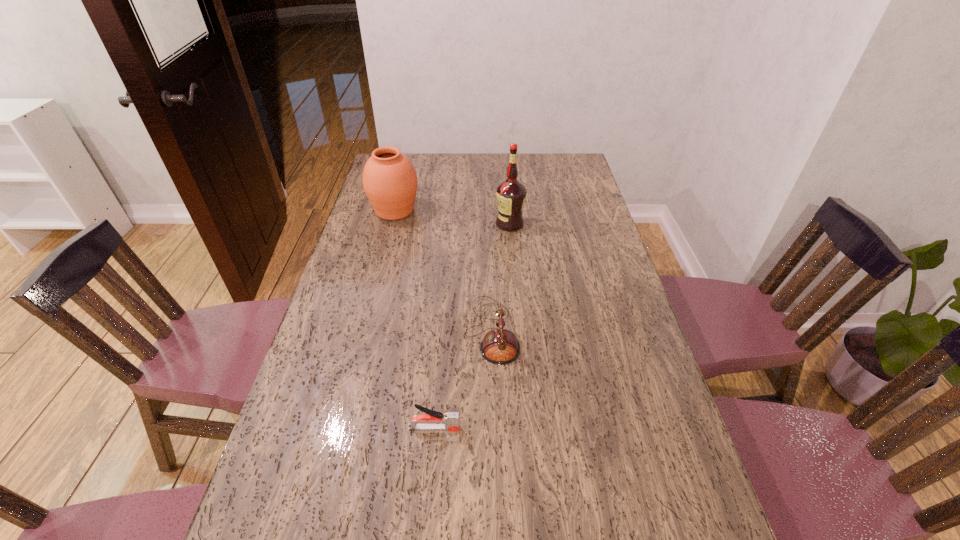
Find the location of a particular element. The width and height of the screenshot is (960, 540). alcohol is located at coordinates (511, 194).

Where is `the second tallest object`? the second tallest object is located at coordinates (390, 182).

Find the location of a particular element. urn is located at coordinates (390, 182).

At what (x,y) coordinates should I click in order to perform the action: click on telephone. Please return your answer as a coordinate pair (x, y). Looking at the image, I should click on (500, 346).

In order to click on the nearest object in this screenshot , I will do `click(449, 421)`.

You are a GUI agent. You are given a task and a screenshot of the screen. Output one action in this format:
    pyautogui.click(x=<x>, y=<y>)
    Task: Click on the stapler
    Image resolution: width=960 pixels, height=540 pixels.
    Given the screenshot: What is the action you would take?
    pyautogui.click(x=449, y=421)

You are a GUI agent. You are given a task and a screenshot of the screen. Output one action in this format:
    pyautogui.click(x=<x>, y=<y>)
    Task: Click on the blank space located on the label of the alcohol
    Image resolution: width=960 pixels, height=540 pixels.
    Given the screenshot: What is the action you would take?
    pyautogui.click(x=410, y=224)

This screenshot has height=540, width=960. I want to click on vacant point located 0.340m on the label of the alcohol, so click(x=402, y=224).

Locate an element on the screen. This screenshot has width=960, height=540. vacant space situated 0.090m on the label of the alcohol is located at coordinates (470, 224).

Locate an element on the screen. The height and width of the screenshot is (540, 960). free spot located 0.350m on the front of the urn is located at coordinates (373, 292).